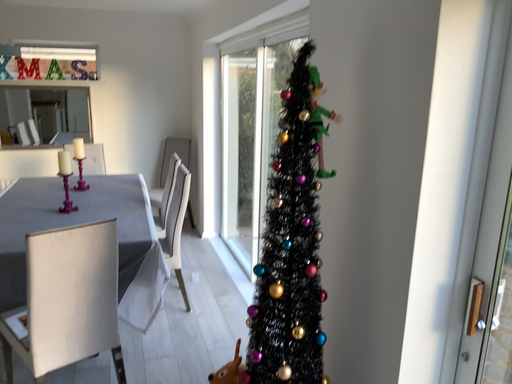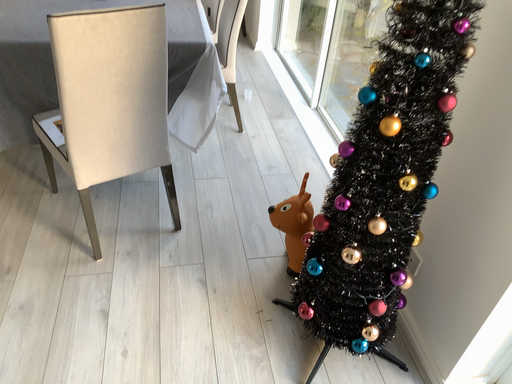
Question: Which way did the camera rotate in the video?

Choices:
 (A) rotated downward
 (B) rotated upward

Answer: (A)